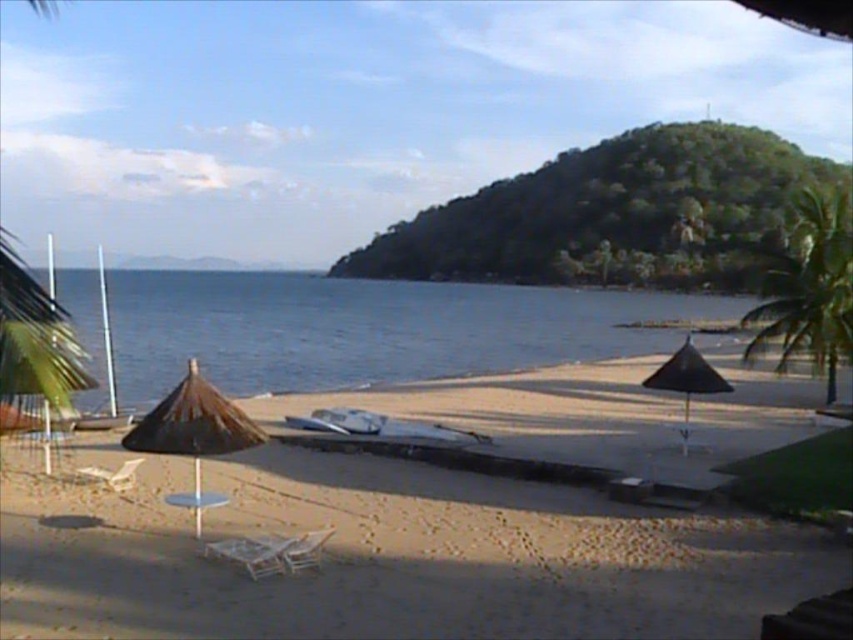
Who is more distant from viewer, (459,332) or (683,365)?

The point (459,332) is behind.

Who is more distant from viewer, (577, 358) or (714, 369)?

Point (577, 358)

Identify the location of blue water at center. (370, 328).

Does wooden beach chair at lower left appear on the left side of white plastic beach chair at lower left?

No, wooden beach chair at lower left is not to the left of white plastic beach chair at lower left.

Which is more to the right, wooden beach chair at lower left or white plastic beach chair at lower left?

wooden beach chair at lower left

This screenshot has height=640, width=853. Describe the element at coordinates (253, 552) in the screenshot. I see `wooden beach chair at lower left` at that location.

Where is `wooden beach chair at lower left`? The height and width of the screenshot is (640, 853). wooden beach chair at lower left is located at coordinates [x=253, y=552].

In the scene shown: Is blue water at center wider than wooden beach chair at lower left?

Yes.

Is the position of blue water at center more distant than that of wooden beach chair at lower left?

No, blue water at center is in front of wooden beach chair at lower left.

Describe the element at coordinates (370, 328) in the screenshot. I see `blue water at center` at that location.

The height and width of the screenshot is (640, 853). Identify the location of blue water at center. click(370, 328).